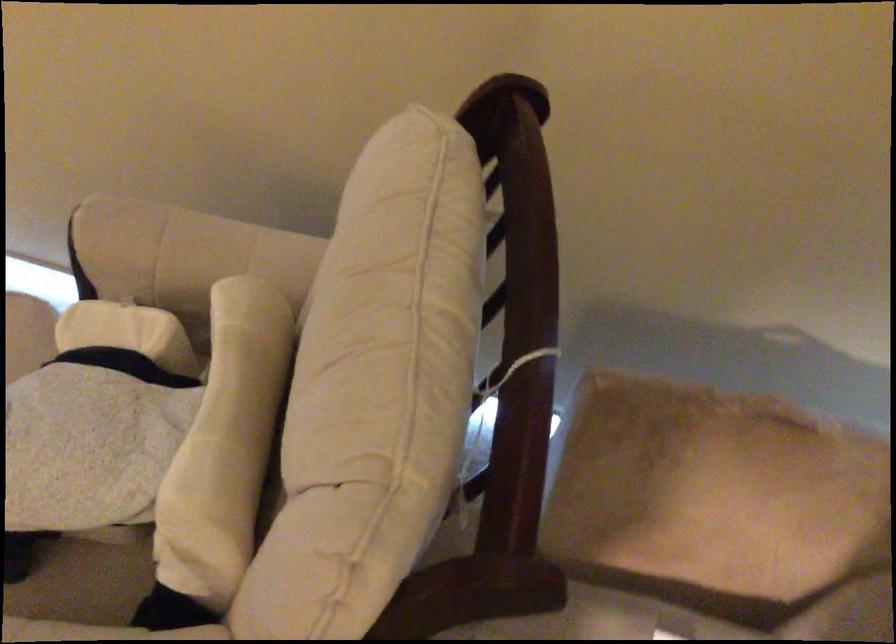
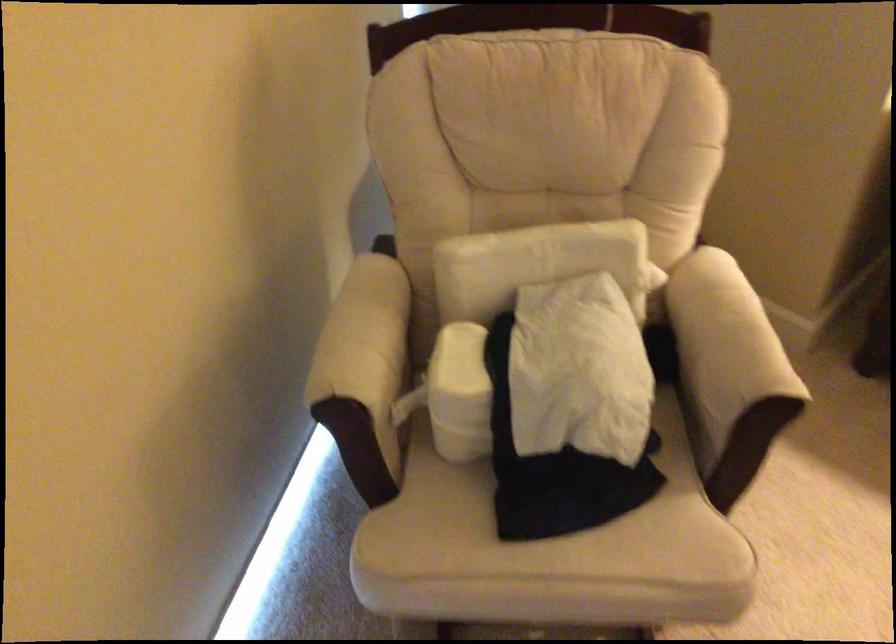
In the second image, find the point that corresponds to (115,240) in the first image.

(364, 373)